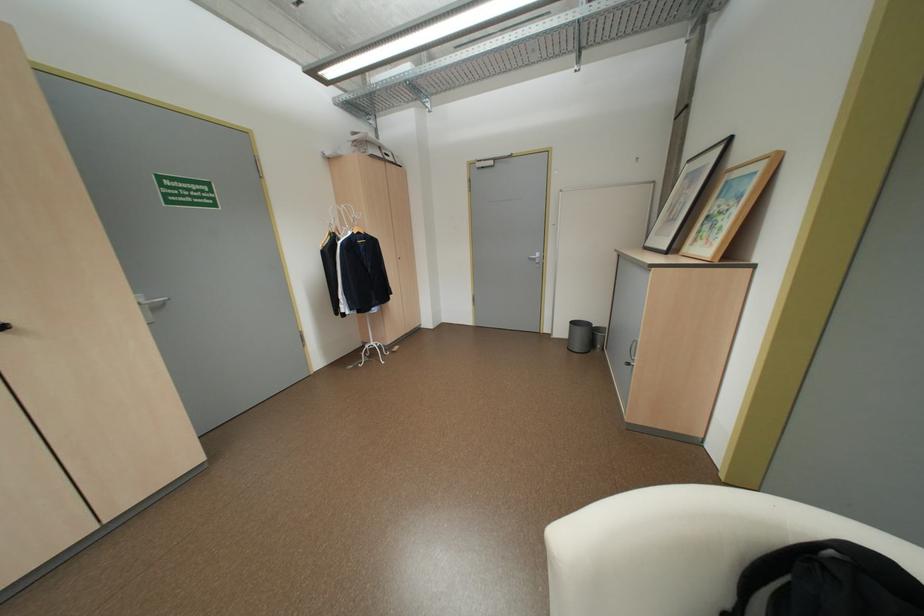
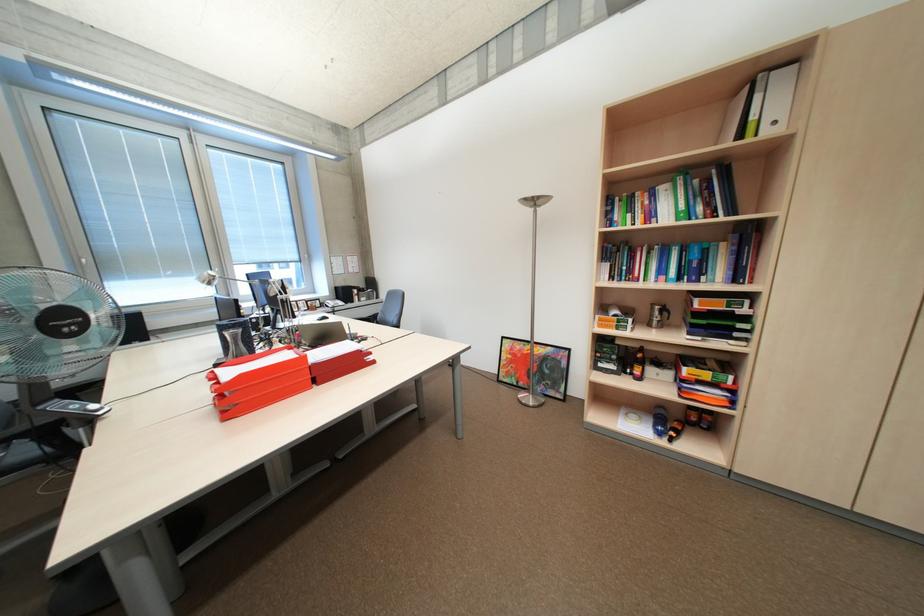
The images are taken continuously from a first-person perspective. In which direction is your viewpoint rotating?

The camera's rotation is toward left-down.